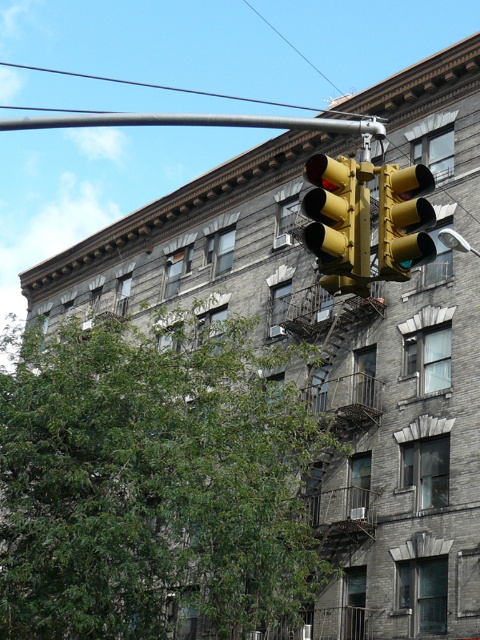
Question: Is yellow matte traffic light at upper center thinner than yellow metallic street light at upper center?

Choices:
 (A) no
 (B) yes

Answer: (B)

Question: Which object is closer to the camera taking this photo?

Choices:
 (A) yellow metallic street light at upper center
 (B) metallic gray pole at upper center

Answer: (B)

Question: Can you confirm if yellow matte traffic light at upper center is positioned below metallic gray pole at upper center?

Choices:
 (A) no
 (B) yes

Answer: (B)

Question: Which point is closer to the camera?

Choices:
 (A) metallic gray pole at upper center
 (B) yellow matte traffic light at upper center
 (C) yellow matte traffic light at center
 (D) yellow metallic street light at upper center

Answer: (B)

Question: Can you confirm if yellow matte traffic light at upper center is wider than yellow matte traffic light at center?

Choices:
 (A) yes
 (B) no

Answer: (A)

Question: Based on their relative distances, which object is nearer to the yellow matte traffic light at center?

Choices:
 (A) yellow matte traffic light at upper center
 (B) yellow metallic street light at upper center
 (C) metallic gray pole at upper center

Answer: (A)